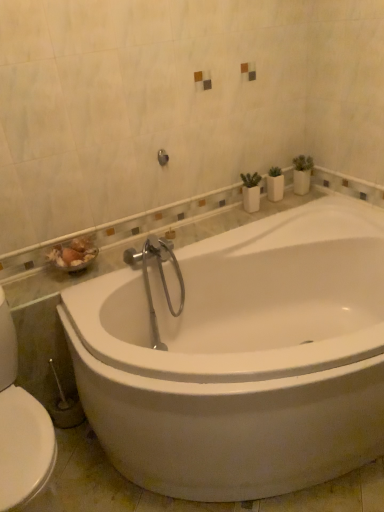
Question: Is brushed metal shower at upper center facing towards white glossy bathtub at center?

Choices:
 (A) no
 (B) yes

Answer: (A)

Question: From the image's perspective, does brushed metal shower at upper center appear higher than white glossy bathtub at center?

Choices:
 (A) no
 (B) yes

Answer: (B)

Question: Considering the relative sizes of brushed metal shower at upper center and white glossy bathtub at center in the image provided, is brushed metal shower at upper center taller than white glossy bathtub at center?

Choices:
 (A) no
 (B) yes

Answer: (A)

Question: From a real-world perspective, is brushed metal shower at upper center under white glossy bathtub at center?

Choices:
 (A) yes
 (B) no

Answer: (B)

Question: Is the depth of brushed metal shower at upper center greater than that of white glossy bathtub at center?

Choices:
 (A) no
 (B) yes

Answer: (B)

Question: Is the surface of brushed metal shower at upper center in direct contact with white glossy bathtub at center?

Choices:
 (A) no
 (B) yes

Answer: (A)

Question: Is white glossy bathtub at center bigger than brushed metal shower at upper center?

Choices:
 (A) yes
 (B) no

Answer: (A)

Question: Considering the relative sizes of white glossy bathtub at center and brushed metal shower at upper center in the image provided, is white glossy bathtub at center taller than brushed metal shower at upper center?

Choices:
 (A) no
 (B) yes

Answer: (B)

Question: Considering the relative sizes of white glossy bathtub at center and brushed metal shower at upper center in the image provided, is white glossy bathtub at center shorter than brushed metal shower at upper center?

Choices:
 (A) no
 (B) yes

Answer: (A)

Question: Does white glossy bathtub at center come in front of brushed metal shower at upper center?

Choices:
 (A) no
 (B) yes

Answer: (B)

Question: Could you tell me if white glossy bathtub at center is facing brushed metal shower at upper center?

Choices:
 (A) no
 (B) yes

Answer: (A)

Question: Considering the relative sizes of white glossy bathtub at center and brushed metal shower at upper center in the image provided, is white glossy bathtub at center thinner than brushed metal shower at upper center?

Choices:
 (A) no
 (B) yes

Answer: (A)

Question: In the image, is white glossy bathtub at center on the left side or the right side of brushed metal shower at upper center?

Choices:
 (A) left
 (B) right

Answer: (B)